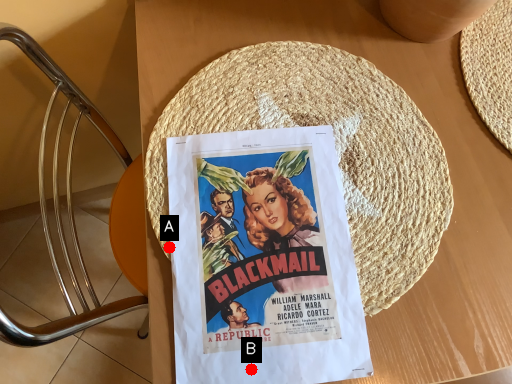
Question: Two points are circled on the image, labeled by A and B beside each circle. Among these points, which one is farthest from the camera?

Choices:
 (A) A is further
 (B) B is further

Answer: (A)